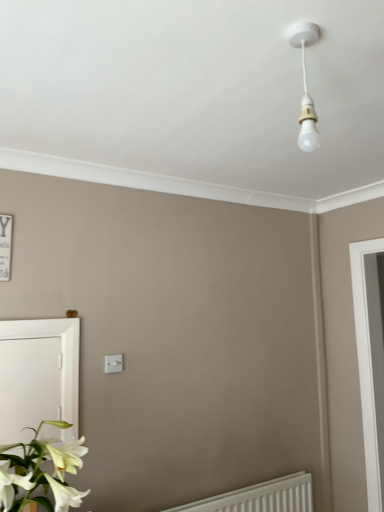
Locate an element on the screen. The height and width of the screenshot is (512, 384). white glossy screen door at lower left is located at coordinates (38, 377).

At what (x,y) coordinates should I click in order to perform the action: click on white glossy screen door at lower left. Please return your answer as a coordinate pair (x, y). Looking at the image, I should click on (38, 377).

Is white glossy flower at lower left oriented away from white plastic radiator at lower right?

white glossy flower at lower left does not have its back to white plastic radiator at lower right.

From a real-world perspective, is white glossy flower at lower left positioned above or below white plastic radiator at lower right?

In terms of real-world spatial position, white glossy flower at lower left is above white plastic radiator at lower right.

In the scene shown: Visually, is white glossy flower at lower left positioned to the left or to the right of white plastic radiator at lower right?

Based on their positions, white glossy flower at lower left is located to the left of white plastic radiator at lower right.

Is white plastic radiator at lower right a part of white glossy flower at lower left?

Actually, white plastic radiator at lower right is outside white glossy flower at lower left.

Which object is further away from the camera taking this photo, white plastic light switch at center or white glossy screen door at lower left?

white plastic light switch at center is further away from the camera.

From the image's perspective, which one is positioned higher, white plastic light switch at center or white glossy screen door at lower left?

white plastic light switch at center is shown above in the image.

Considering the sizes of objects white plastic light switch at center and white glossy screen door at lower left in the image provided, who is thinner, white plastic light switch at center or white glossy screen door at lower left?

Thinner between the two is white plastic light switch at center.

Where is `screen door that is below the white plastic light switch at center (from the image's perspective)`? Image resolution: width=384 pixels, height=512 pixels. screen door that is below the white plastic light switch at center (from the image's perspective) is located at coordinates click(x=38, y=377).

In terms of height, does white glossy screen door at lower left look taller or shorter compared to white plastic light switch at center?

white glossy screen door at lower left is taller than white plastic light switch at center.

What's the angular difference between white glossy screen door at lower left and white plastic light switch at center's facing directions?

white glossy screen door at lower left and white plastic light switch at center are facing 0.523 degrees away from each other.

Measure the distance from white glossy screen door at lower left to white plastic light switch at center.

A distance of 13.32 inches exists between white glossy screen door at lower left and white plastic light switch at center.

At what (x,y) coordinates should I click in order to perform the action: click on light switch above the white glossy screen door at lower left (from the image's perspective). Please return your answer as a coordinate pair (x, y). The image size is (384, 512). Looking at the image, I should click on (113, 362).

I want to click on radiator to the right of white glossy screen door at lower left, so click(x=260, y=497).

Considering the relative positions of white glossy screen door at lower left and white plastic radiator at lower right in the image provided, is white glossy screen door at lower left to the left of white plastic radiator at lower right from the viewer's perspective?

Correct, you'll find white glossy screen door at lower left to the left of white plastic radiator at lower right.

From a real-world perspective, is white glossy screen door at lower left located beneath white plastic radiator at lower right?

Actually, white glossy screen door at lower left is physically above white plastic radiator at lower right in the real world.

In the scene shown: Which is less distant, (13, 323) or (308, 496)?

Positioned in front is point (13, 323).

Is white plastic radiator at lower right at the right side of white glossy flower at lower left?

Indeed, white plastic radiator at lower right is positioned on the right side of white glossy flower at lower left.

You are a GUI agent. You are given a task and a screenshot of the screen. Output one action in this format:
    pyautogui.click(x=<x>, y=<y>)
    Task: Click on the houseplant on the left of white plastic radiator at lower right
    This screenshot has height=512, width=384.
    Given the screenshot: What is the action you would take?
    pyautogui.click(x=41, y=472)

What's the angular difference between white plastic radiator at lower right and white glossy flower at lower left's facing directions?

white plastic radiator at lower right and white glossy flower at lower left are facing 0.541 degrees away from each other.

From the image's perspective, is white plastic radiator at lower right below white glossy flower at lower left?

Indeed, from the image's perspective, white plastic radiator at lower right is shown beneath white glossy flower at lower left.

Is white glossy screen door at lower left inside white plastic radiator at lower right?

Definitely not — white glossy screen door at lower left is not inside white plastic radiator at lower right.

There is a white plastic radiator at lower right. At what (x,y) coordinates should I click in order to perform the action: click on screen door above it (from a real-world perspective). Please return your answer as a coordinate pair (x, y). The height and width of the screenshot is (512, 384). Looking at the image, I should click on (38, 377).

Considering the positions of objects white plastic radiator at lower right and white glossy screen door at lower left in the image provided, who is more to the right, white plastic radiator at lower right or white glossy screen door at lower left?

From the viewer's perspective, white plastic radiator at lower right appears more on the right side.

Can you tell me how much white plastic radiator at lower right and white glossy screen door at lower left differ in facing direction?

0.856 degrees.

How distant is white plastic light switch at center from white glossy flower at lower left?

white plastic light switch at center is 25.19 inches away from white glossy flower at lower left.

Is white plastic light switch at center positioned in front of white glossy flower at lower left?

No, white plastic light switch at center is behind white glossy flower at lower left.

In the image, is white plastic light switch at center on the left side or the right side of white glossy flower at lower left?

Based on their positions, white plastic light switch at center is located to the right of white glossy flower at lower left.

Where is `radiator below the white glossy flower at lower left (from a real-world perspective)`? This screenshot has height=512, width=384. radiator below the white glossy flower at lower left (from a real-world perspective) is located at coordinates click(260, 497).

Find the location of a particular element. Image resolution: width=384 pixels, height=512 pixels. light switch above the white glossy screen door at lower left (from a real-world perspective) is located at coordinates (113, 362).

Which object lies further to the anchor point white glossy screen door at lower left, white plastic radiator at lower right or white glossy flower at lower left?

Among the two, white plastic radiator at lower right is located further to white glossy screen door at lower left.

In the scene shown: From the image, which object appears to be farther from white plastic radiator at lower right, white glossy screen door at lower left or white plastic light switch at center?

white plastic light switch at center is positioned further to the anchor white plastic radiator at lower right.

Estimate the real-world distances between objects in this image. Which object is further from white plastic light switch at center, white plastic radiator at lower right or white glossy screen door at lower left?

white plastic radiator at lower right lies further to white plastic light switch at center than the other object.

From the image, which object appears to be farther from white glossy screen door at lower left, white glossy flower at lower left or white plastic radiator at lower right?

white plastic radiator at lower right lies further to white glossy screen door at lower left than the other object.

Estimate the real-world distances between objects in this image. Which object is further from white plastic light switch at center, white glossy screen door at lower left or white plastic radiator at lower right?

white plastic radiator at lower right is further to white plastic light switch at center.

Estimate the real-world distances between objects in this image. Which object is further from white plastic radiator at lower right, white glossy flower at lower left or white glossy screen door at lower left?

white glossy screen door at lower left is positioned further to the anchor white plastic radiator at lower right.

From the image, which object appears to be nearer to white glossy screen door at lower left, white plastic radiator at lower right or white plastic light switch at center?

The object closer to white glossy screen door at lower left is white plastic light switch at center.

Looking at the image, which one is located further to white glossy flower at lower left, white glossy screen door at lower left or white plastic light switch at center?

Among the two, white plastic light switch at center is located further to white glossy flower at lower left.

This screenshot has width=384, height=512. In order to click on screen door between white glossy flower at lower left and white plastic light switch at center along the z-axis in this screenshot , I will do `click(38, 377)`.

This screenshot has width=384, height=512. In order to click on radiator positioned between white glossy flower at lower left and white plastic light switch at center from near to far in this screenshot , I will do `click(260, 497)`.

Identify the location of screen door between white plastic light switch at center and white plastic radiator at lower right vertically. The height and width of the screenshot is (512, 384). (38, 377).

In order to click on houseplant between white glossy screen door at lower left and white plastic radiator at lower right in this screenshot , I will do `click(41, 472)`.